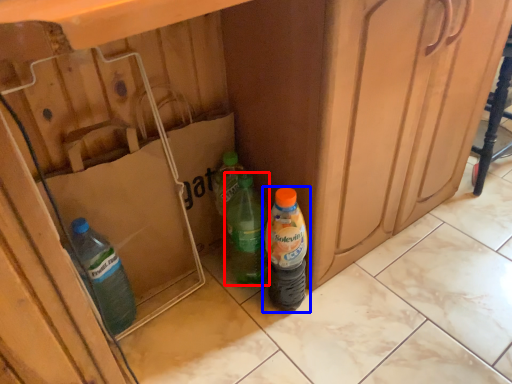
Question: Which of the following is the farthest to the observer, bottle (highlighted by a red box) or bottle (highlighted by a blue box)?

Choices:
 (A) bottle
 (B) bottle

Answer: (A)